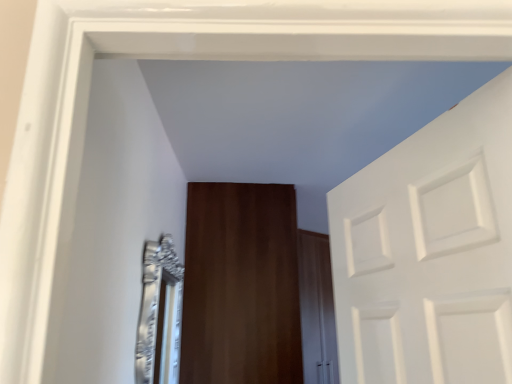
Question: From the image's perspective, is silver metallic mirror at left below wooden door at center?

Choices:
 (A) no
 (B) yes

Answer: (A)

Question: From a real-world perspective, is silver metallic mirror at left below wooden door at center?

Choices:
 (A) no
 (B) yes

Answer: (B)

Question: From a real-world perspective, does silver metallic mirror at left stand above wooden door at center?

Choices:
 (A) yes
 (B) no

Answer: (B)

Question: From the image's perspective, would you say silver metallic mirror at left is positioned over wooden door at center?

Choices:
 (A) yes
 (B) no

Answer: (A)

Question: Is the depth of silver metallic mirror at left greater than that of wooden door at center?

Choices:
 (A) no
 (B) yes

Answer: (A)

Question: Considering the relative positions of silver metallic mirror at left and wooden door at center in the image provided, is silver metallic mirror at left in front of wooden door at center?

Choices:
 (A) yes
 (B) no

Answer: (A)

Question: Is the surface of wooden door at center in direct contact with silver metallic mirror at left?

Choices:
 (A) no
 (B) yes

Answer: (A)

Question: Is wooden door at center oriented away from silver metallic mirror at left?

Choices:
 (A) yes
 (B) no

Answer: (B)

Question: From the image's perspective, is wooden door at center beneath silver metallic mirror at left?

Choices:
 (A) no
 (B) yes

Answer: (B)

Question: Does wooden door at center have a smaller size compared to silver metallic mirror at left?

Choices:
 (A) no
 (B) yes

Answer: (A)

Question: Is wooden door at center to the right of silver metallic mirror at left from the viewer's perspective?

Choices:
 (A) no
 (B) yes

Answer: (B)

Question: Can you confirm if wooden door at center is taller than silver metallic mirror at left?

Choices:
 (A) yes
 (B) no

Answer: (A)

Question: In the image, is wooden door at center on the left side or the right side of silver metallic mirror at left?

Choices:
 (A) right
 (B) left

Answer: (A)